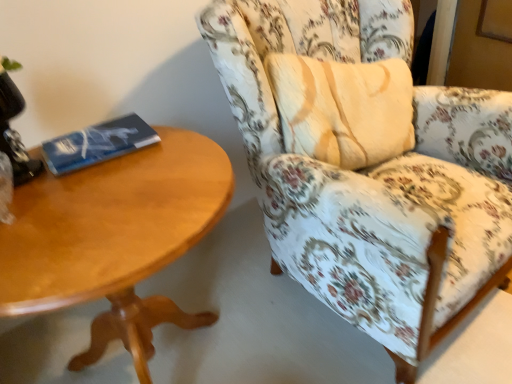
What do you see at coordinates (12, 129) in the screenshot? I see `black glass table lamp at upper left` at bounding box center [12, 129].

Identify the location of blue matte paperback book at left. (98, 143).

From a real-world perspective, is floral fabric chair at right on top of light brown wood coffee table at left?

Yes, from a real-world perspective, floral fabric chair at right is over light brown wood coffee table at left

Is floral fabric chair at right to the left or to the right of light brown wood coffee table at left in the image?

In the image, floral fabric chair at right appears on the right side of light brown wood coffee table at left.

Which is correct: floral fabric chair at right is inside light brown wood coffee table at left, or outside of it?

floral fabric chair at right is located beyond the bounds of light brown wood coffee table at left.

In the scene shown: Is floral fabric chair at right facing towards light brown wood coffee table at left?

No.

From the image's perspective, is floral fabric chair at right over blue matte paperback book at left?

No, from the image's perspective, floral fabric chair at right is not over blue matte paperback book at left.

Considering the sizes of objects floral fabric chair at right and blue matte paperback book at left in the image provided, who is wider, floral fabric chair at right or blue matte paperback book at left?

With larger width is floral fabric chair at right.

Locate an element on the screen. The image size is (512, 384). chair below the blue matte paperback book at left (from the image's perspective) is located at coordinates (372, 178).

From a real-world perspective, between blue matte paperback book at left and black glass table lamp at upper left, who is vertically higher?

black glass table lamp at upper left.

Based on their positions, is blue matte paperback book at left located to the left or right of black glass table lamp at upper left?

From the image, it's evident that blue matte paperback book at left is to the right of black glass table lamp at upper left.

How far apart are blue matte paperback book at left and black glass table lamp at upper left?

blue matte paperback book at left and black glass table lamp at upper left are 5.22 inches apart from each other.

Considering the relative sizes of blue matte paperback book at left and black glass table lamp at upper left in the image provided, is blue matte paperback book at left taller than black glass table lamp at upper left?

No.

Can you tell me how much floral fabric chair at right and black glass table lamp at upper left differ in facing direction?

There is a 3.91-degree angle between the facing directions of floral fabric chair at right and black glass table lamp at upper left.

Are floral fabric chair at right and black glass table lamp at upper left beside each other?

No, floral fabric chair at right is not next to black glass table lamp at upper left.

Does floral fabric chair at right appear on the right side of black glass table lamp at upper left?

Yes.

Considering the sizes of floral fabric chair at right and black glass table lamp at upper left in the image, is floral fabric chair at right taller or shorter than black glass table lamp at upper left?

Considering their sizes, floral fabric chair at right has more height than black glass table lamp at upper left.

Which is in front, black glass table lamp at upper left or light brown wood coffee table at left?

light brown wood coffee table at left.

In the scene shown: Which is more to the left, black glass table lamp at upper left or light brown wood coffee table at left?

From the viewer's perspective, black glass table lamp at upper left appears more on the left side.

Considering the points (17, 98) and (134, 305), which point is in front, point (17, 98) or point (134, 305)?

Point (17, 98)

Is blue matte paperback book at left to the right of floral fabric chair at right from the viewer's perspective?

No.

Is blue matte paperback book at left facing towards floral fabric chair at right?

No, blue matte paperback book at left is not oriented towards floral fabric chair at right.

Is floral fabric chair at right completely or partially inside blue matte paperback book at left?

No.

How much distance is there between blue matte paperback book at left and floral fabric chair at right?

blue matte paperback book at left and floral fabric chair at right are 53.38 centimeters apart.

Consider the image. Between light brown wood coffee table at left and black glass table lamp at upper left, which one has less height?

black glass table lamp at upper left.

Could you tell me if light brown wood coffee table at left is facing black glass table lamp at upper left?

No, light brown wood coffee table at left is not facing towards black glass table lamp at upper left.

Considering the positions of objects light brown wood coffee table at left and black glass table lamp at upper left in the image provided, who is more to the right, light brown wood coffee table at left or black glass table lamp at upper left?

From the viewer's perspective, light brown wood coffee table at left appears more on the right side.

Looking at this image, is light brown wood coffee table at left positioned far away from black glass table lamp at upper left?

light brown wood coffee table at left is near black glass table lamp at upper left, not far away.

The image size is (512, 384). In order to click on coffee table that appears in front of the floral fabric chair at right in this screenshot , I will do `click(114, 239)`.

The height and width of the screenshot is (384, 512). Identify the location of paperback book on the left of the floral fabric chair at right. (98, 143).

Estimate the real-world distances between objects in this image. Which object is closer to floral fabric chair at right, light brown wood coffee table at left or black glass table lamp at upper left?

Among the two, light brown wood coffee table at left is located nearer to floral fabric chair at right.

Looking at the image, which one is located further to floral fabric chair at right, light brown wood coffee table at left or blue matte paperback book at left?

The object further to floral fabric chair at right is blue matte paperback book at left.

Based on their spatial positions, is light brown wood coffee table at left or blue matte paperback book at left closer to black glass table lamp at upper left?

The object closer to black glass table lamp at upper left is blue matte paperback book at left.

Which object lies further to the anchor point blue matte paperback book at left, light brown wood coffee table at left or black glass table lamp at upper left?

light brown wood coffee table at left is positioned further to the anchor blue matte paperback book at left.

Based on their spatial positions, is black glass table lamp at upper left or blue matte paperback book at left closer to floral fabric chair at right?

Among the two, blue matte paperback book at left is located nearer to floral fabric chair at right.

Looking at this image, looking at the image, which one is located further to light brown wood coffee table at left, black glass table lamp at upper left or blue matte paperback book at left?

black glass table lamp at upper left is further to light brown wood coffee table at left.

When comparing their distances from floral fabric chair at right, does black glass table lamp at upper left or light brown wood coffee table at left seem further?

black glass table lamp at upper left is positioned further to the anchor floral fabric chair at right.

Estimate the real-world distances between objects in this image. Which object is further from floral fabric chair at right, blue matte paperback book at left or black glass table lamp at upper left?

black glass table lamp at upper left is positioned further to the anchor floral fabric chair at right.

Where is `paperback book between black glass table lamp at upper left and floral fabric chair at right`? The height and width of the screenshot is (384, 512). paperback book between black glass table lamp at upper left and floral fabric chair at right is located at coordinates (98, 143).

Locate an element on the screen. The height and width of the screenshot is (384, 512). coffee table located between black glass table lamp at upper left and floral fabric chair at right in the left-right direction is located at coordinates (114, 239).

Locate an element on the screen. Image resolution: width=512 pixels, height=384 pixels. paperback book between black glass table lamp at upper left and light brown wood coffee table at left in the up-down direction is located at coordinates (98, 143).

Where is `coffee table between blue matte paperback book at left and floral fabric chair at right from left to right`? This screenshot has height=384, width=512. coffee table between blue matte paperback book at left and floral fabric chair at right from left to right is located at coordinates (114, 239).